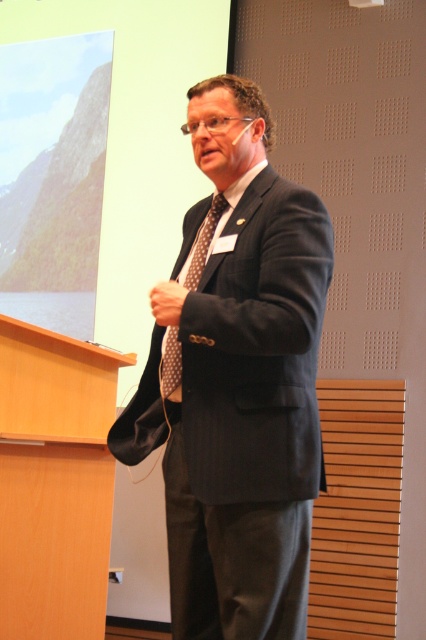
Question: Is matte black suit at center further to the viewer compared to brown dotted tie at center?

Choices:
 (A) no
 (B) yes

Answer: (A)

Question: Which point is farther to the camera?

Choices:
 (A) matte black suit at center
 (B) brown dotted tie at center

Answer: (B)

Question: Is matte black suit at center to the right of brown dotted tie at center from the viewer's perspective?

Choices:
 (A) no
 (B) yes

Answer: (B)

Question: Observing the image, what is the correct spatial positioning of matte black suit at center in reference to brown dotted tie at center?

Choices:
 (A) above
 (B) below

Answer: (B)